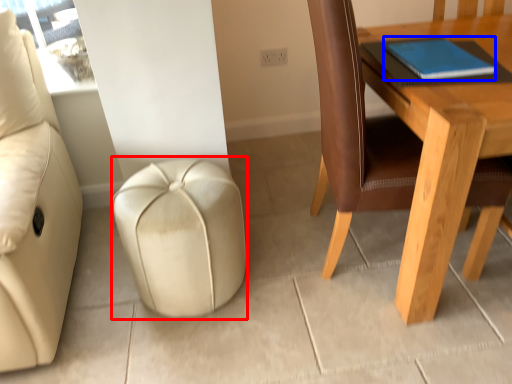
Question: Which point is further to the camera, stool (highlighted by a red box) or notebook (highlighted by a blue box)?

Choices:
 (A) stool
 (B) notebook

Answer: (A)